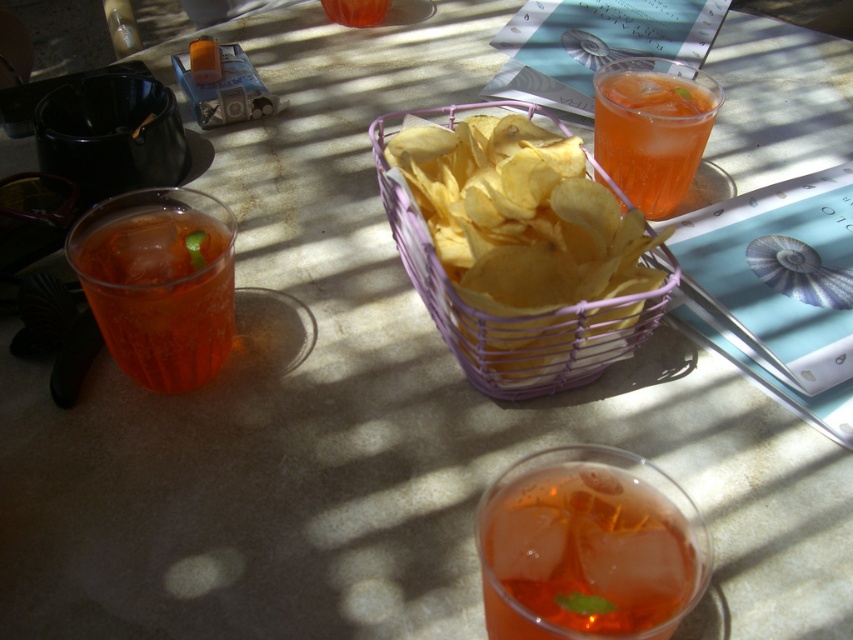
You are at a patio party and want to choose a drink. You prefer a larger drink. Which one between the translucent glass drink at left and the translucent glass drink at upper right should you pick?

The translucent glass drink at upper right is larger in size compared to the translucent glass drink at left, so you should pick the translucent glass drink at upper right.

You are standing at the edge of the table looking towards the center. Which of the two points, point (643, 484) or point (431, 276), is closer to you?

Point (643, 484) is closer to the viewer than point (431, 276).

Looking at this image, you are holding a camera and want to take a photo of the point at coordinates point (636, 593). If the camera has a minimum focus distance of 12 inches, will it be able to focus on the point?

The point (636, 593) is 11.86 inches away from the camera, which is within the camera minimum focus distance of 12 inches. Therefore, the camera can focus on the point.